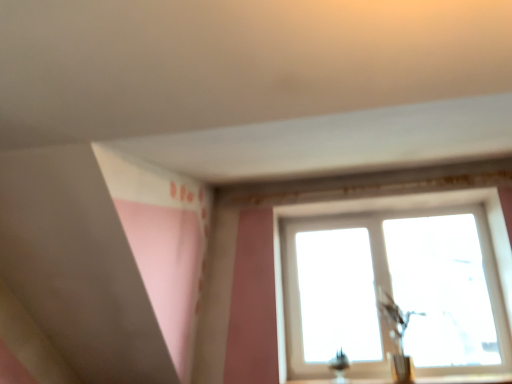
Where is `transparent glass window at center`? This screenshot has height=384, width=512. transparent glass window at center is located at coordinates (394, 209).

Image resolution: width=512 pixels, height=384 pixels. Describe the element at coordinates (394, 209) in the screenshot. I see `transparent glass window at center` at that location.

At what (x,y) coordinates should I click in order to perform the action: click on transparent glass window at center. Please return your answer as a coordinate pair (x, y). This screenshot has height=384, width=512. Looking at the image, I should click on (394, 209).